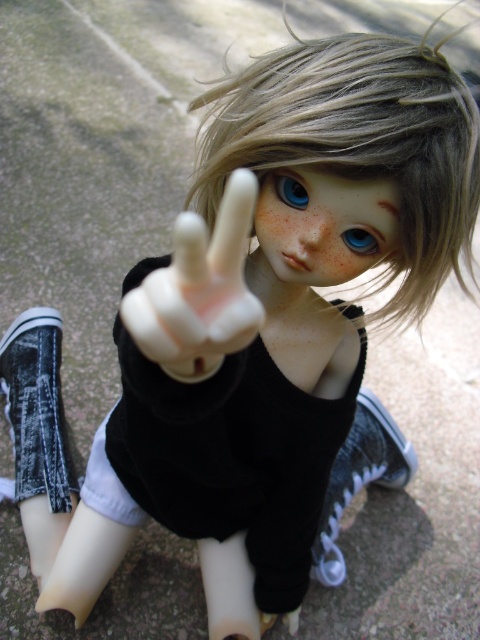
In the scene shown: You are a toy designer examining the doll. You need to determine which feature, the blondehair at center or the blue glossy eye at center, requires more material for production. Based on the doll, which one would need more material?

The blondehair at center requires more material because its width is larger than the blue glossy eye at center.